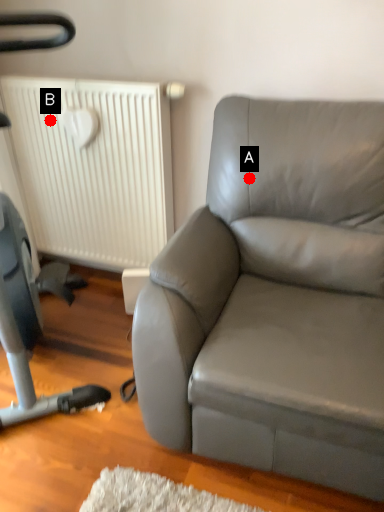
Question: Two points are circled on the image, labeled by A and B beside each circle. Which point is closer to the camera taking this photo?

Choices:
 (A) A is closer
 (B) B is closer

Answer: (A)